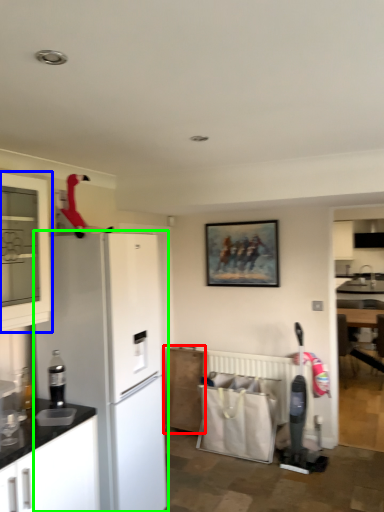
Question: Which object is the farthest from cabinetry (highlighted by a red box)? Choose among these: cabinetry (highlighted by a blue box) or refrigerator (highlighted by a green box).

Choices:
 (A) cabinetry
 (B) refrigerator

Answer: (A)